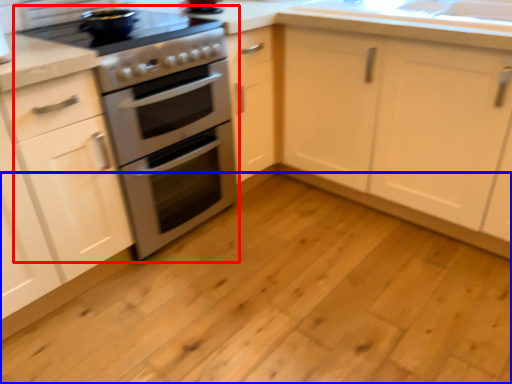
Question: Which object is closer to the camera taking this photo, appliance (highlighted by a red box) or plain (highlighted by a blue box)?

Choices:
 (A) appliance
 (B) plain

Answer: (B)